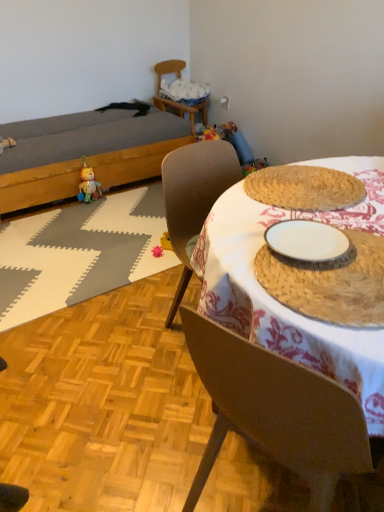
Question: Is pink rubber toy at center, the second toy positioned from the left, shorter than woven straw placemat at center?

Choices:
 (A) no
 (B) yes

Answer: (A)

Question: From the image's perspective, is pink rubber toy at center, positioned as the 1th toy in right-to-left order, located above woven straw placemat at center?

Choices:
 (A) no
 (B) yes

Answer: (A)

Question: From a real-world perspective, is pink rubber toy at center, positioned as the first toy in bottom-to-top order, beneath woven straw placemat at center?

Choices:
 (A) no
 (B) yes

Answer: (A)

Question: Can you confirm if pink rubber toy at center, the second toy from the back, is thinner than woven straw placemat at center?

Choices:
 (A) no
 (B) yes

Answer: (B)

Question: Does pink rubber toy at center, which is the 2th toy in top-to-bottom order, have a greater width compared to woven straw placemat at center?

Choices:
 (A) no
 (B) yes

Answer: (A)

Question: Is woven straw placemat at center inside plush yellow bear at lower left, which ranks as the second toy in bottom-to-top order?

Choices:
 (A) no
 (B) yes

Answer: (A)

Question: Is plush yellow bear at lower left, acting as the 1th toy starting from the left, beside woven straw placemat at center?

Choices:
 (A) no
 (B) yes

Answer: (A)

Question: Does plush yellow bear at lower left, which ranks as the second toy in bottom-to-top order, come behind woven straw placemat at center?

Choices:
 (A) yes
 (B) no

Answer: (A)

Question: Is plush yellow bear at lower left, the 2th toy in the front-to-back sequence, smaller than woven straw placemat at center?

Choices:
 (A) yes
 (B) no

Answer: (A)

Question: Is plush yellow bear at lower left, acting as the 1th toy starting from the left, wider than woven straw placemat at center?

Choices:
 (A) yes
 (B) no

Answer: (B)

Question: From the image's perspective, is plush yellow bear at lower left, arranged as the first toy when viewed from the top, under woven straw placemat at center?

Choices:
 (A) no
 (B) yes

Answer: (A)

Question: Considering the relative sizes of rattan placemat at center and white ceramic plate at center in the image provided, is rattan placemat at center shorter than white ceramic plate at center?

Choices:
 (A) no
 (B) yes

Answer: (A)